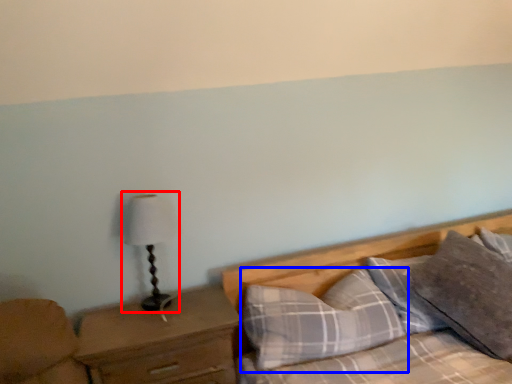
Question: Which object is further to the camera taking this photo, table lamp (highlighted by a red box) or pillow (highlighted by a blue box)?

Choices:
 (A) table lamp
 (B) pillow

Answer: (A)